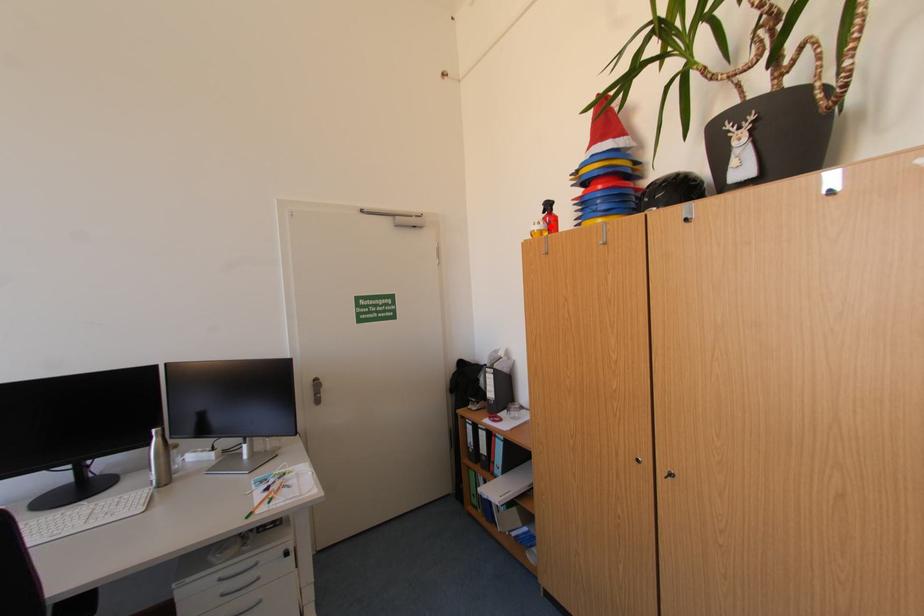
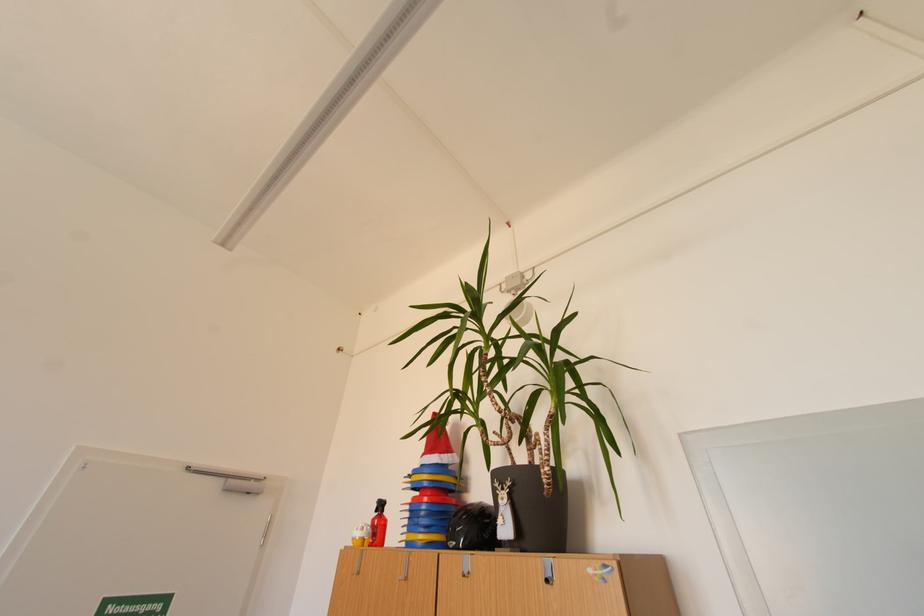
Find the pixel in the second image that matches the highlighted location in the first image.

(373, 533)